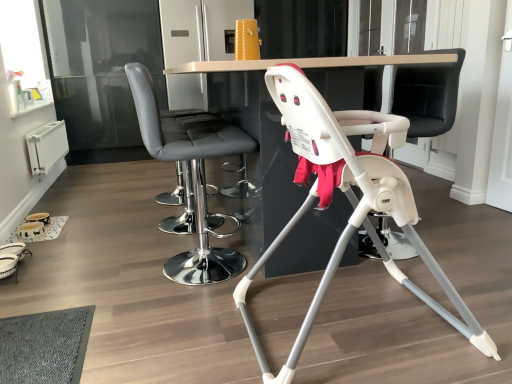
Locate an element on the screen. This screenshot has width=512, height=384. matte gray bar stool at center, which ranks as the first chair in left-to-right order is located at coordinates (193, 181).

What is the approximate height of matte gray bar stool at center, marked as the second chair in a right-to-left arrangement?

It is 90.64 centimeters.

Locate an element on the screen. white plastic highchair at center, which is the first chair in right-to-left order is located at coordinates (348, 199).

The height and width of the screenshot is (384, 512). What do you see at coordinates (280, 118) in the screenshot? I see `white glossy table at center` at bounding box center [280, 118].

What do you see at coordinates (428, 95) in the screenshot? This screenshot has height=384, width=512. I see `white plastic swivel chair at center` at bounding box center [428, 95].

This screenshot has height=384, width=512. Identify the location of matte gray bar stool at center, which ranks as the first chair in left-to-right order. (193, 181).

How many degrees apart are the facing directions of white glossy table at center and white plastic highchair at center, which is the first chair in right-to-left order?

There is a 0.569-degree angle between the facing directions of white glossy table at center and white plastic highchair at center, which is the first chair in right-to-left order.

From the image's perspective, which is above, white glossy table at center or white plastic highchair at center, the second chair viewed from the left?

white glossy table at center.

Is white glossy table at center positioned in front of white plastic highchair at center, which is the first chair in right-to-left order?

No.

Which is correct: white plastic highchair at center, which is the first chair in right-to-left order, is inside white plastic swivel chair at center, or outside of it?

white plastic highchair at center, which is the first chair in right-to-left order, cannot be found inside white plastic swivel chair at center.

Which is in front, point (443, 281) or point (442, 91)?

The point (443, 281) is closer.

Is white plastic highchair at center, the second chair viewed from the left, shorter than white plastic swivel chair at center?

Correct, white plastic highchair at center, the second chair viewed from the left, is not as tall as white plastic swivel chair at center.

From the image's perspective, is white plastic highchair at center, the second chair viewed from the left, under white plastic swivel chair at center?

Yes.

Is point (380, 190) farther from camera compared to point (162, 156)?

That is False.

From a real-world perspective, is white plastic highchair at center, the second chair viewed from the left, above or below matte gray bar stool at center, marked as the second chair in a right-to-left arrangement?

Clearly, from a real-world perspective, white plastic highchair at center, the second chair viewed from the left, is below matte gray bar stool at center, marked as the second chair in a right-to-left arrangement.

Where is `chair above the white plastic highchair at center, the second chair viewed from the left (from the image's perspective)`? This screenshot has height=384, width=512. chair above the white plastic highchair at center, the second chair viewed from the left (from the image's perspective) is located at coordinates (193, 181).

From a real-world perspective, is matte gray bar stool at center, marked as the second chair in a right-to-left arrangement, physically located above or below white plastic swivel chair at center?

In terms of real-world spatial position, matte gray bar stool at center, marked as the second chair in a right-to-left arrangement, is below white plastic swivel chair at center.

Which object is thinner, matte gray bar stool at center, which ranks as the first chair in left-to-right order, or white plastic swivel chair at center?

With smaller width is white plastic swivel chair at center.

What's the angular difference between matte gray bar stool at center, marked as the second chair in a right-to-left arrangement, and white plastic swivel chair at center's facing directions?

180 degrees separate the facing orientations of matte gray bar stool at center, marked as the second chair in a right-to-left arrangement, and white plastic swivel chair at center.

Which is in front, point (140, 83) or point (483, 348)?

Positioned in front is point (483, 348).

Is matte gray bar stool at center, marked as the second chair in a right-to-left arrangement, facing towards white plastic highchair at center, which is the first chair in right-to-left order?

No, matte gray bar stool at center, marked as the second chair in a right-to-left arrangement, is not oriented towards white plastic highchair at center, which is the first chair in right-to-left order.

From a real-world perspective, is matte gray bar stool at center, which ranks as the first chair in left-to-right order, physically above white plastic highchair at center, which is the first chair in right-to-left order?

Yes, from a real-world perspective, matte gray bar stool at center, which ranks as the first chair in left-to-right order, is above white plastic highchair at center, which is the first chair in right-to-left order.

Is matte gray bar stool at center, marked as the second chair in a right-to-left arrangement, not inside white plastic highchair at center, which is the first chair in right-to-left order?

Yes, matte gray bar stool at center, marked as the second chair in a right-to-left arrangement, is located beyond the bounds of white plastic highchair at center, which is the first chair in right-to-left order.

From a real-world perspective, between white plastic swivel chair at center and white plastic highchair at center, the second chair viewed from the left, who is vertically lower?

white plastic highchair at center, the second chair viewed from the left, is physically lower.

Is white plastic swivel chair at center not within white plastic highchair at center, which is the first chair in right-to-left order?

white plastic swivel chair at center is positioned outside white plastic highchair at center, which is the first chair in right-to-left order.

Considering the points (433, 113) and (476, 345), which point is in front, point (433, 113) or point (476, 345)?

The point (476, 345) is in front.

Looking at this image, which of these two, white plastic swivel chair at center or white plastic highchair at center, the second chair viewed from the left, stands taller?

white plastic swivel chair at center is taller.

Who is smaller, white plastic highchair at center, which is the first chair in right-to-left order, or white glossy table at center?

Smaller between the two is white plastic highchair at center, which is the first chair in right-to-left order.

From the picture: From a real-world perspective, does white plastic highchair at center, which is the first chair in right-to-left order, sit lower than white glossy table at center?

Yes, from a real-world perspective, white plastic highchair at center, which is the first chair in right-to-left order, is under white glossy table at center.

Which object is closer to the camera taking this photo, white plastic highchair at center, the second chair viewed from the left, or white glossy table at center?

white plastic highchair at center, the second chair viewed from the left, is closer to the camera.

You are a GUI agent. You are given a task and a screenshot of the screen. Output one action in this format:
    pyautogui.click(x=<x>, y=<y>)
    Task: Click on the table above the white plastic highchair at center, the second chair viewed from the left (from a real-world perspective)
    
    Given the screenshot: What is the action you would take?
    pyautogui.click(x=280, y=118)

The image size is (512, 384). I want to click on swivel chair on the right of the white plastic highchair at center, which is the first chair in right-to-left order, so click(x=428, y=95).

Estimate the real-world distances between objects in this image. Which object is closer to white plastic highchair at center, which is the first chair in right-to-left order, matte gray bar stool at center, which ranks as the first chair in left-to-right order, or white glossy table at center?

white glossy table at center.

Considering their positions, is white glossy table at center positioned further to white plastic swivel chair at center than matte gray bar stool at center, which ranks as the first chair in left-to-right order?

Based on the image, matte gray bar stool at center, which ranks as the first chair in left-to-right order, appears to be further to white plastic swivel chair at center.

Which object lies further to the anchor point white plastic swivel chair at center, matte gray bar stool at center, marked as the second chair in a right-to-left arrangement, or white plastic highchair at center, which is the first chair in right-to-left order?

matte gray bar stool at center, marked as the second chair in a right-to-left arrangement, is positioned further to the anchor white plastic swivel chair at center.

From the image, which object appears to be nearer to white plastic swivel chair at center, white glossy table at center or white plastic highchair at center, the second chair viewed from the left?

white glossy table at center.

Estimate the real-world distances between objects in this image. Which object is further from white plastic swivel chair at center, white plastic highchair at center, the second chair viewed from the left, or matte gray bar stool at center, marked as the second chair in a right-to-left arrangement?

Based on the image, matte gray bar stool at center, marked as the second chair in a right-to-left arrangement, appears to be further to white plastic swivel chair at center.

Which object lies nearer to the anchor point white plastic highchair at center, which is the first chair in right-to-left order, white glossy table at center or white plastic swivel chair at center?

The object closer to white plastic highchair at center, which is the first chair in right-to-left order, is white glossy table at center.

Which object lies further to the anchor point white plastic swivel chair at center, white plastic highchair at center, the second chair viewed from the left, or white glossy table at center?

Among the two, white plastic highchair at center, the second chair viewed from the left, is located further to white plastic swivel chair at center.

Looking at this image, which object lies further to the anchor point matte gray bar stool at center, which ranks as the first chair in left-to-right order, white plastic highchair at center, which is the first chair in right-to-left order, or white glossy table at center?

white plastic highchair at center, which is the first chair in right-to-left order, is further to matte gray bar stool at center, which ranks as the first chair in left-to-right order.

Locate an element on the screen. chair between matte gray bar stool at center, which ranks as the first chair in left-to-right order, and white plastic swivel chair at center from left to right is located at coordinates (348, 199).

Where is `table between matte gray bar stool at center, which ranks as the first chair in left-to-right order, and white plastic swivel chair at center, in the horizontal direction`? This screenshot has width=512, height=384. table between matte gray bar stool at center, which ranks as the first chair in left-to-right order, and white plastic swivel chair at center, in the horizontal direction is located at coordinates (280, 118).

Locate an element on the screen. The height and width of the screenshot is (384, 512). table between white plastic highchair at center, which is the first chair in right-to-left order, and matte gray bar stool at center, marked as the second chair in a right-to-left arrangement, in the front-back direction is located at coordinates (280, 118).

Find the location of a particular element. table between white plastic highchair at center, the second chair viewed from the left, and white plastic swivel chair at center, along the z-axis is located at coordinates (280, 118).